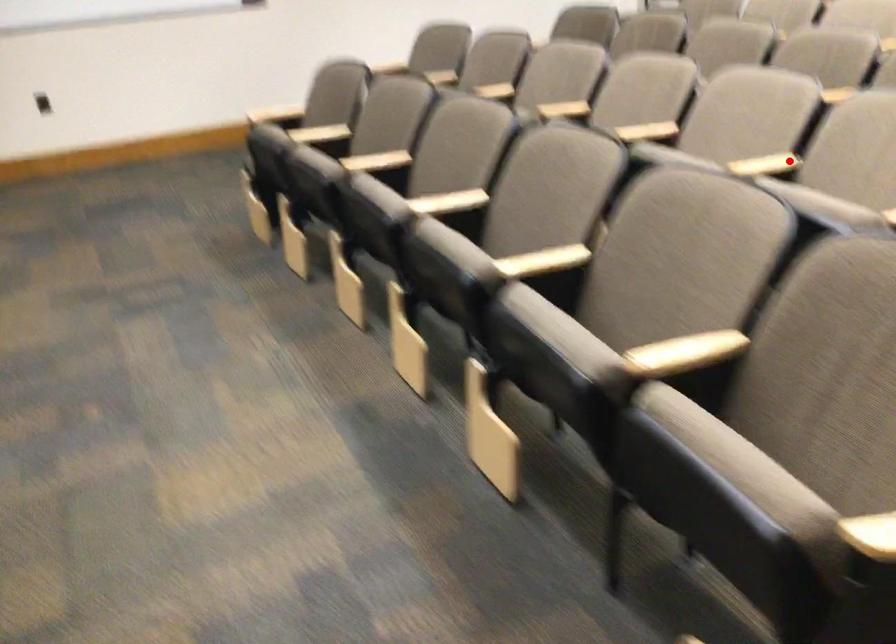
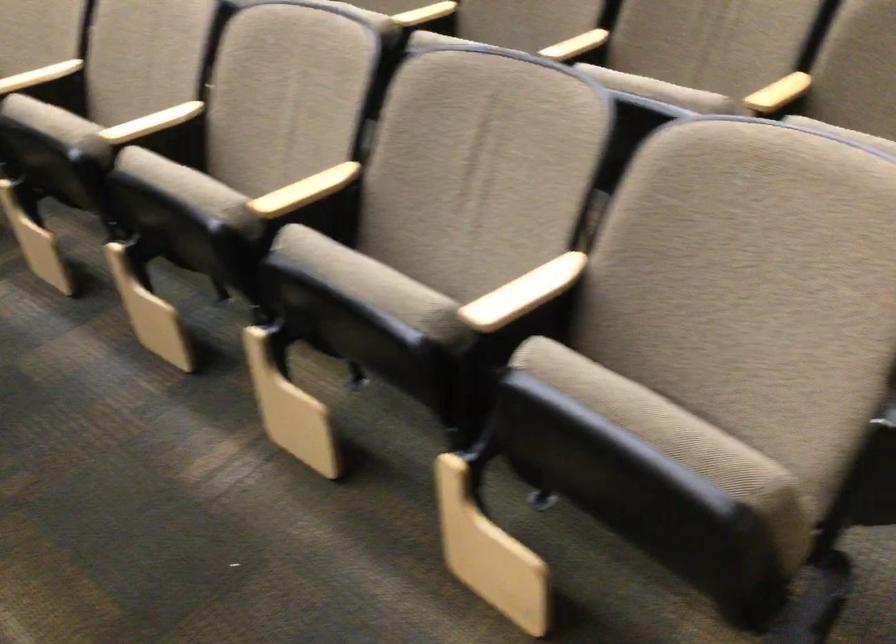
Question: I am providing you with two images of the same scene from different viewpoints. A red point is shown in image1. For the corresponding object point in image2, is it positioned nearer or farther from the camera?

Choices:
 (A) Nearer
 (B) Farther

Answer: (A)